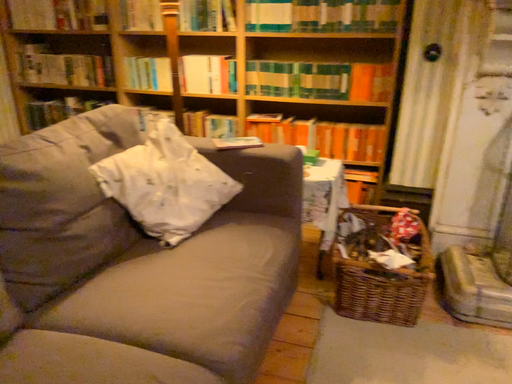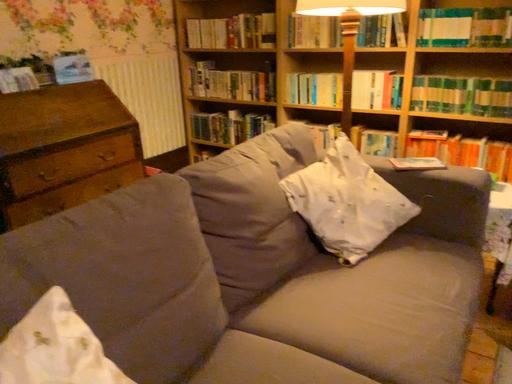
Question: How did the camera likely rotate when shooting the video?

Choices:
 (A) rotated right
 (B) rotated left

Answer: (B)